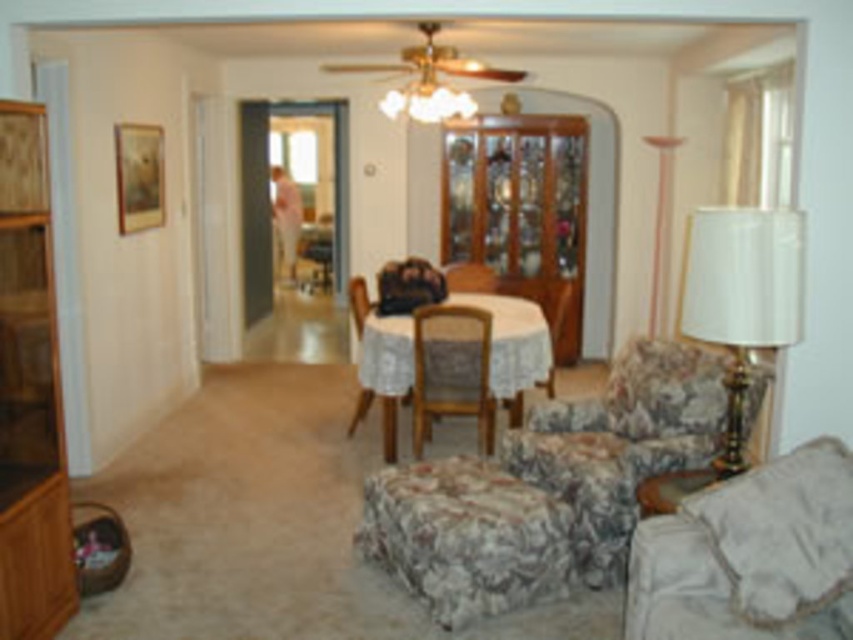
Does fluffy beige couch at lower right have a lesser height compared to white fabric lampshade at right?

Yes.

Image resolution: width=853 pixels, height=640 pixels. What do you see at coordinates (750, 556) in the screenshot? I see `fluffy beige couch at lower right` at bounding box center [750, 556].

Based on the photo, who is more distant from viewer, (697, 512) or (730, 212)?

Positioned behind is point (697, 512).

This screenshot has width=853, height=640. What are the coordinates of `fluffy beige couch at lower right` in the screenshot? It's located at (750, 556).

The image size is (853, 640). What are the coordinates of `white fabric lampshade at right` in the screenshot? It's located at (741, 294).

Is point (747, 358) less distant than point (467, 275)?

Yes, it is in front of point (467, 275).

Does point (704, 240) lie behind point (469, 282)?

That is False.

The image size is (853, 640). I want to click on white fabric lampshade at right, so click(x=741, y=294).

Can you confirm if floral fabric ottoman at lower center is positioned above white fabric lampshade at right?

Incorrect, floral fabric ottoman at lower center is not positioned above white fabric lampshade at right.

Between floral fabric ottoman at lower center and white fabric lampshade at right, which one appears on the right side from the viewer's perspective?

Positioned to the right is white fabric lampshade at right.

Locate an element on the screen. floral fabric ottoman at lower center is located at coordinates (466, 536).